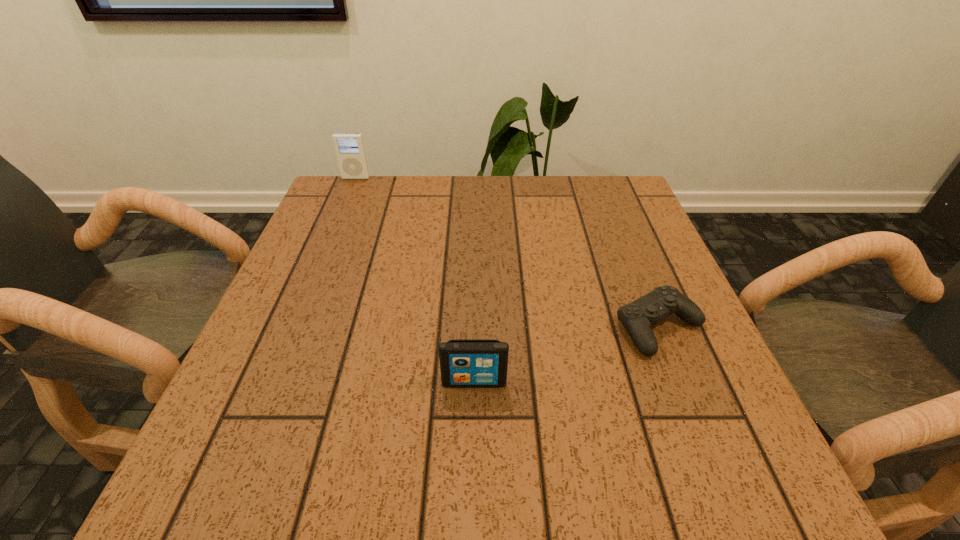
Find the location of a particular element. The image size is (960, 540). vacant space at the near right corner is located at coordinates (774, 493).

I want to click on vacant region between the second tallest object and the shortest object, so click(566, 355).

Locate an element on the screen. Image resolution: width=960 pixels, height=540 pixels. free space between the left iPod and the shortest object is located at coordinates (508, 253).

You are a GUI agent. You are given a task and a screenshot of the screen. Output one action in this format:
    pyautogui.click(x=<x>, y=<y>)
    Task: Click on the empty space between the nearest object and the control
    
    Given the screenshot: What is the action you would take?
    pyautogui.click(x=566, y=355)

You are a GUI agent. You are given a task and a screenshot of the screen. Output one action in this format:
    pyautogui.click(x=<x>, y=<y>)
    Task: Click on the vacant area between the farther iPod and the nearer iPod
    The image size is (960, 540).
    Given the screenshot: What is the action you would take?
    point(415,280)

At what (x,y) coordinates should I click in order to perform the action: click on free area in between the control and the second tallest object. Please return your answer as a coordinate pair (x, y). This screenshot has height=540, width=960. Looking at the image, I should click on (566, 355).

In order to click on unoccupied position between the second farthest object and the second shortest object in this screenshot , I will do `click(566, 355)`.

I want to click on free area in between the second object from left to right and the control, so click(x=566, y=355).

Find the location of a particular element. The width and height of the screenshot is (960, 540). vacant point located between the left iPod and the second farthest object is located at coordinates (508, 253).

The height and width of the screenshot is (540, 960). In order to click on vacant area that lies between the second nearest object and the right iPod in this screenshot , I will do `click(566, 355)`.